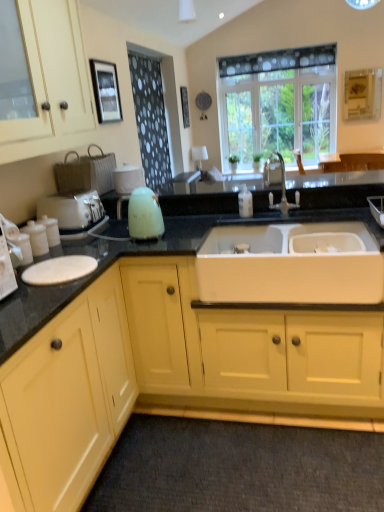
Question: Considering the relative positions of dark gray carpet at lower center and white plastic toaster at left in the image provided, is dark gray carpet at lower center in front of white plastic toaster at left?

Choices:
 (A) yes
 (B) no

Answer: (A)

Question: Is dark gray carpet at lower center looking in the opposite direction of white plastic toaster at left?

Choices:
 (A) no
 (B) yes

Answer: (A)

Question: Does dark gray carpet at lower center have a larger size compared to white plastic toaster at left?

Choices:
 (A) yes
 (B) no

Answer: (A)

Question: Is dark gray carpet at lower center not inside white plastic toaster at left?

Choices:
 (A) no
 (B) yes

Answer: (B)

Question: Does dark gray carpet at lower center lie behind white plastic toaster at left?

Choices:
 (A) yes
 (B) no

Answer: (B)

Question: From the image's perspective, is dark gray carpet at lower center located above or below black granite countertop at center?

Choices:
 (A) below
 (B) above

Answer: (A)

Question: Considering the positions of dark gray carpet at lower center and black granite countertop at center in the image, is dark gray carpet at lower center bigger or smaller than black granite countertop at center?

Choices:
 (A) small
 (B) big

Answer: (A)

Question: Based on their positions, is dark gray carpet at lower center located to the left or right of black granite countertop at center?

Choices:
 (A) left
 (B) right

Answer: (B)

Question: Is dark gray carpet at lower center spatially inside black granite countertop at center, or outside of it?

Choices:
 (A) inside
 (B) outside

Answer: (B)

Question: Relative to silver metallic faucet at upper center, is black granite countertop at center in front or behind?

Choices:
 (A) behind
 (B) front

Answer: (B)

Question: Is black granite countertop at center taller or shorter than silver metallic faucet at upper center?

Choices:
 (A) tall
 (B) short

Answer: (A)

Question: From the image's perspective, is black granite countertop at center above or below silver metallic faucet at upper center?

Choices:
 (A) below
 (B) above

Answer: (A)

Question: Would you say black granite countertop at center is inside or outside silver metallic faucet at upper center?

Choices:
 (A) outside
 (B) inside

Answer: (A)

Question: Based on their positions, is yellow matte cabinet at left, the first cabinetry in the bottom-to-top sequence, located to the left or right of white matte sink at center?

Choices:
 (A) right
 (B) left

Answer: (B)

Question: Is point (18, 411) closer or farther from the camera than point (319, 253)?

Choices:
 (A) closer
 (B) farther

Answer: (A)